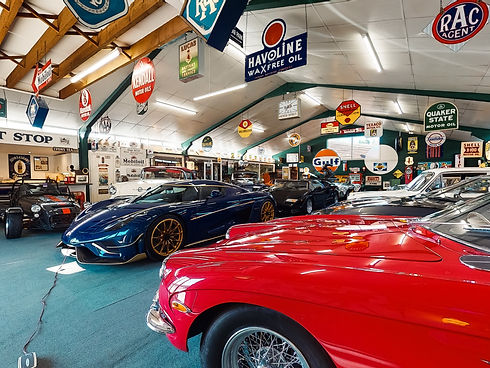
Where is `ceiling`? This screenshot has width=490, height=368. ceiling is located at coordinates (398, 62).